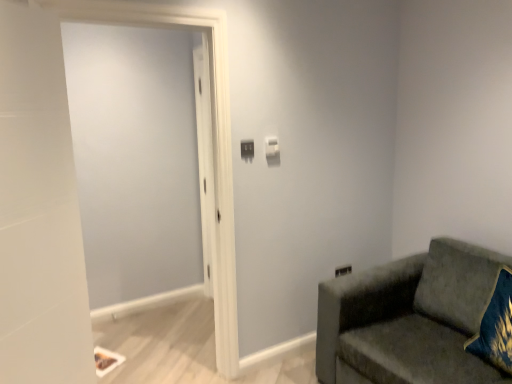
Question: Is the depth of velvet green couch at right greater than that of matte plastic light switch at center, which appears as the first light switch when viewed from the front?

Choices:
 (A) no
 (B) yes

Answer: (A)

Question: Considering the relative sizes of velvet green couch at right and matte plastic light switch at center, which appears as the first light switch when viewed from the front, in the image provided, is velvet green couch at right thinner than matte plastic light switch at center, which appears as the first light switch when viewed from the front,?

Choices:
 (A) no
 (B) yes

Answer: (A)

Question: Is velvet green couch at right shorter than matte plastic light switch at center, arranged as the 2th light switch when viewed from the right?

Choices:
 (A) yes
 (B) no

Answer: (B)

Question: Is velvet green couch at right at the right side of matte plastic light switch at center, which appears as the first light switch when viewed from the front?

Choices:
 (A) yes
 (B) no

Answer: (A)

Question: Could you tell me if velvet green couch at right is facing matte plastic light switch at center, which appears as the first light switch when viewed from the front?

Choices:
 (A) no
 (B) yes

Answer: (A)

Question: Is white plastic light switch at upper center, the 2th light switch when ordered from left to right, wider or thinner than velvet green couch at right?

Choices:
 (A) wide
 (B) thin

Answer: (B)

Question: Visually, is white plastic light switch at upper center, the 2th light switch when ordered from left to right, positioned to the left or to the right of velvet green couch at right?

Choices:
 (A) left
 (B) right

Answer: (A)

Question: Is white plastic light switch at upper center, the 1th light switch positioned from the right, bigger or smaller than velvet green couch at right?

Choices:
 (A) small
 (B) big

Answer: (A)

Question: Is white plastic light switch at upper center, the 1th light switch positioned from the back, taller or shorter than velvet green couch at right?

Choices:
 (A) short
 (B) tall

Answer: (A)

Question: Is point (492, 352) positioned closer to the camera than point (245, 153)?

Choices:
 (A) farther
 (B) closer

Answer: (B)

Question: Do you think velvet blue pillow at lower right is within matte plastic light switch at center, which appears as the first light switch when viewed from the front, or outside of it?

Choices:
 (A) inside
 (B) outside

Answer: (B)

Question: Considering the positions of velvet blue pillow at lower right and matte plastic light switch at center, acting as the 1th light switch starting from the left, in the image, is velvet blue pillow at lower right bigger or smaller than matte plastic light switch at center, acting as the 1th light switch starting from the left,?

Choices:
 (A) small
 (B) big

Answer: (B)

Question: Considering the positions of velvet blue pillow at lower right and matte plastic light switch at center, which appears as the first light switch when viewed from the front, in the image, is velvet blue pillow at lower right wider or thinner than matte plastic light switch at center, which appears as the first light switch when viewed from the front,?

Choices:
 (A) thin
 (B) wide

Answer: (B)

Question: In terms of height, does white plastic light switch at upper center, the 2th light switch when ordered from left to right, look taller or shorter compared to matte plastic light switch at center, acting as the 1th light switch starting from the left?

Choices:
 (A) short
 (B) tall

Answer: (A)

Question: In the image, is white plastic light switch at upper center, the 1th light switch positioned from the back, positioned in front of or behind matte plastic light switch at center, acting as the 1th light switch starting from the left?

Choices:
 (A) front
 (B) behind

Answer: (B)